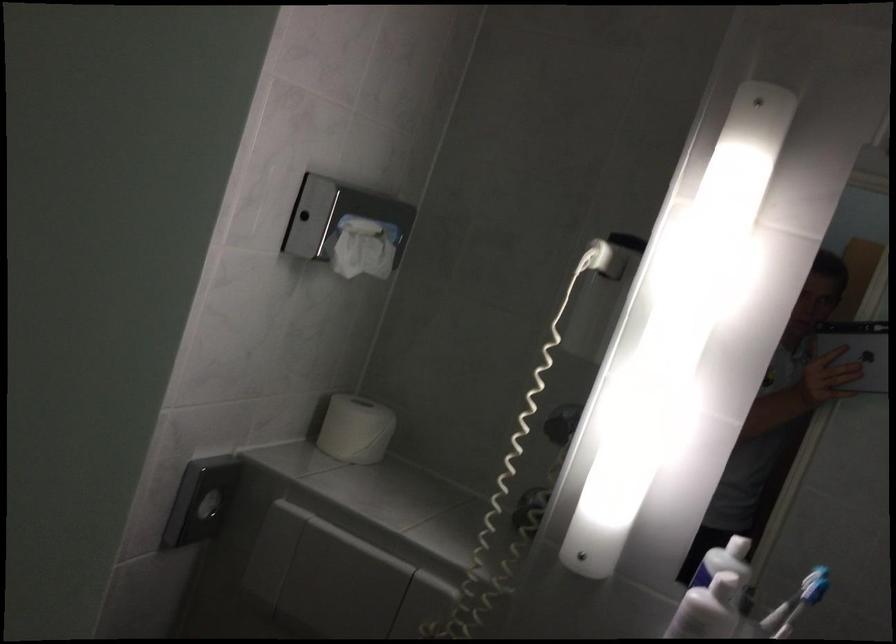
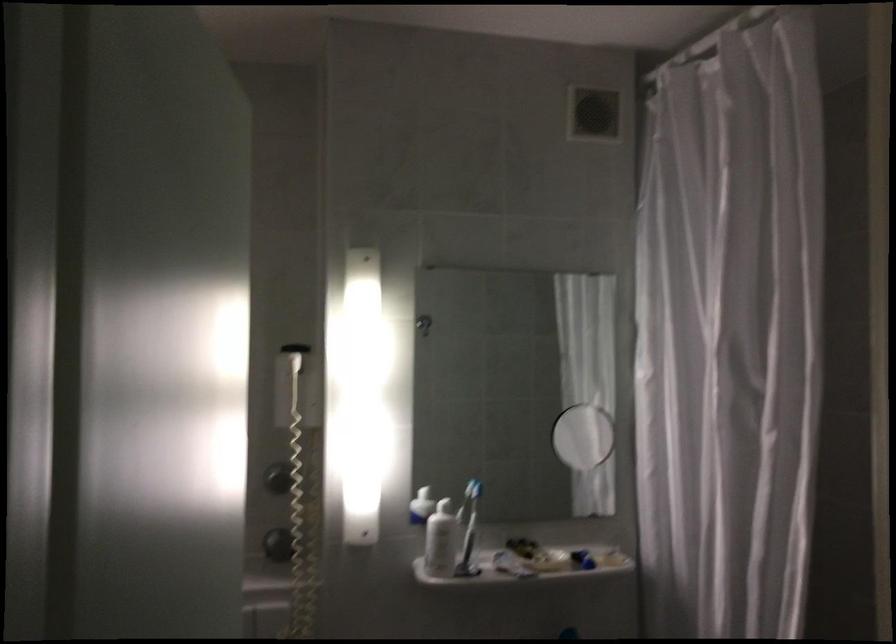
Question: I am providing you with two images of the same scene from different viewpoints. Please identify which objects are invisible in image2.

Choices:
 (A) dispensed facial tissue
 (B) brown ottoman
 (C) blue toothbrush
 (D) white soap bottle

Answer: (A)